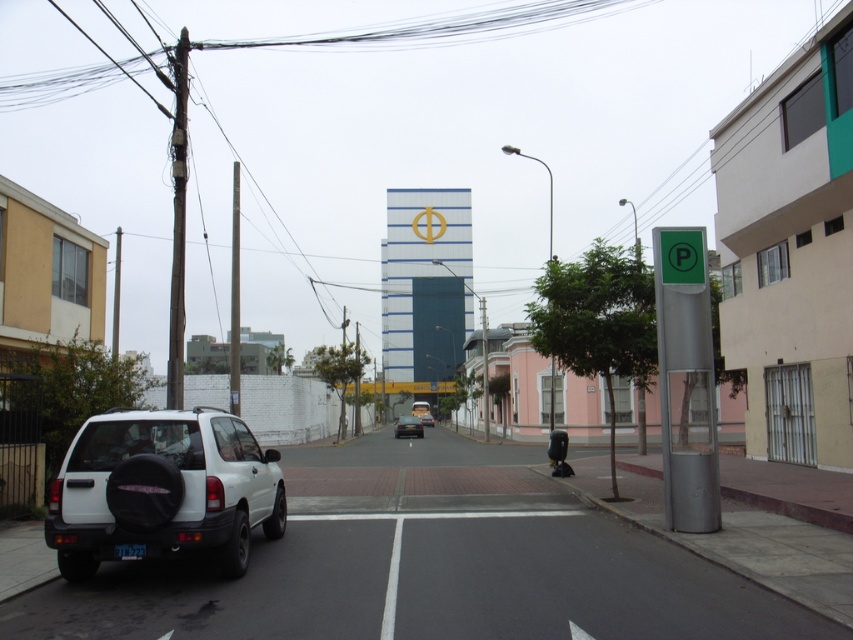
Between black plastic license plate at lower left and white matte car at center, which one has more height?

With more height is white matte car at center.

Who is more forward, (125, 545) or (426, 424)?

Point (125, 545)

Find the location of a particular element. This screenshot has height=640, width=853. black plastic license plate at lower left is located at coordinates (129, 550).

The height and width of the screenshot is (640, 853). What are the coordinates of `black plastic license plate at lower left` in the screenshot? It's located at (129, 550).

Between green metallic parking sign at right and white matte car at center, which one is positioned higher?

green metallic parking sign at right

Which is more to the left, green metallic parking sign at right or white matte car at center?

From the viewer's perspective, white matte car at center appears more on the left side.

The image size is (853, 640). I want to click on green metallic parking sign at right, so (685, 380).

Where is `green metallic parking sign at right`? This screenshot has width=853, height=640. green metallic parking sign at right is located at coordinates (685, 380).

Is the position of white matte suv at lower left more distant than that of green metallic parking sign at right?

No.

Between white matte suv at lower left and green metallic parking sign at right, which one has less height?

white matte suv at lower left

Between point (131, 536) and point (680, 403), which one is positioned in front?

Point (131, 536) is in front.

The width and height of the screenshot is (853, 640). Identify the location of white matte suv at lower left. (161, 490).